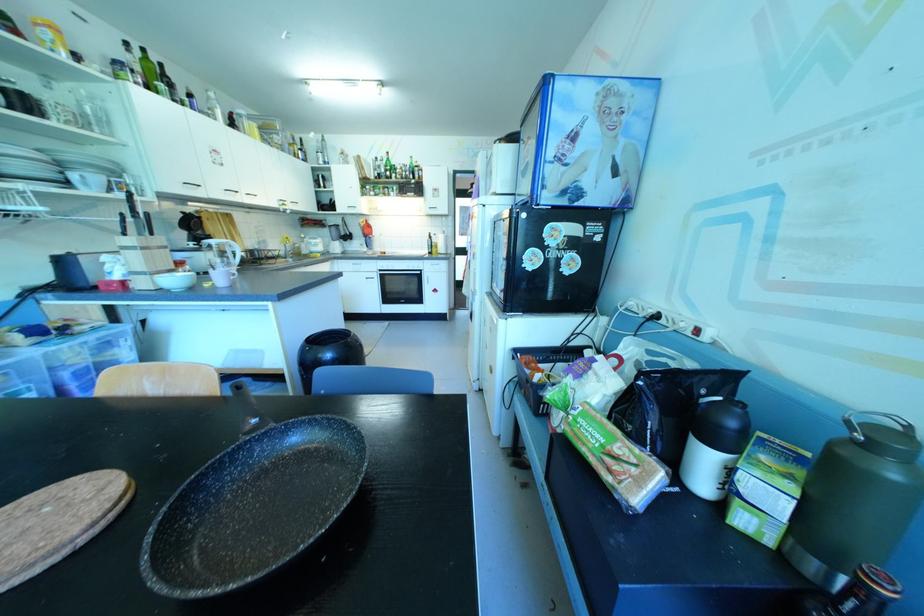
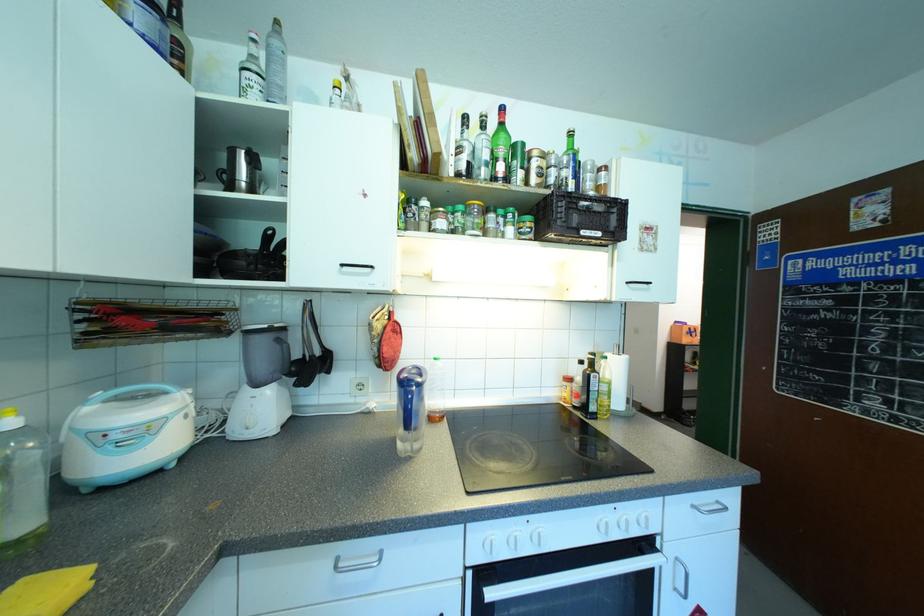
The point at (387, 172) is marked in the first image. Where is the corresponding point in the second image?

(500, 167)